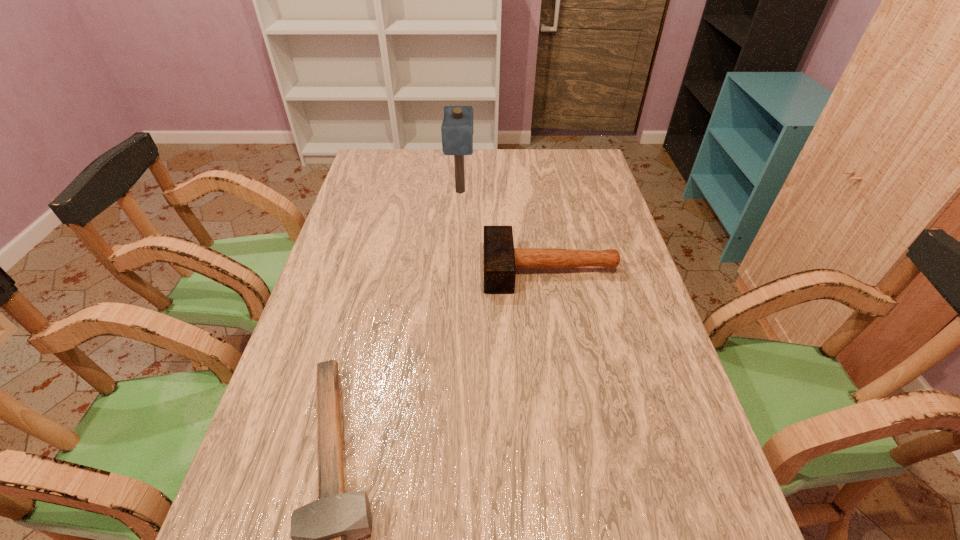
What are the coordinates of `the farthest object` in the screenshot? It's located at (457, 127).

Locate an element on the screen. Image resolution: width=960 pixels, height=540 pixels. the farthest mallet is located at coordinates (457, 127).

Image resolution: width=960 pixels, height=540 pixels. I want to click on the rightmost object, so click(x=501, y=259).

This screenshot has width=960, height=540. I want to click on the second tallest mallet, so click(x=501, y=259).

Locate an element on the screen. The width and height of the screenshot is (960, 540). free point located on the right of the second object from left to right is located at coordinates (529, 192).

Identify the location of free space located on the hammer head face of the second farthest object. This screenshot has height=540, width=960. 384,269.

You are a GUI agent. You are given a task and a screenshot of the screen. Output one action in this format:
    pyautogui.click(x=<x>, y=<y>)
    Task: Click on the free region located on the hammer head face of the second farthest object
    The image size is (960, 540).
    Given the screenshot: What is the action you would take?
    pyautogui.click(x=406, y=269)

This screenshot has width=960, height=540. I want to click on vacant area situated on the hammer head face of the second farthest object, so click(x=466, y=269).

Where is `object at the far edge`? The image size is (960, 540). object at the far edge is located at coordinates (457, 127).

Where is `object that is at the right edge`? object that is at the right edge is located at coordinates (501, 259).